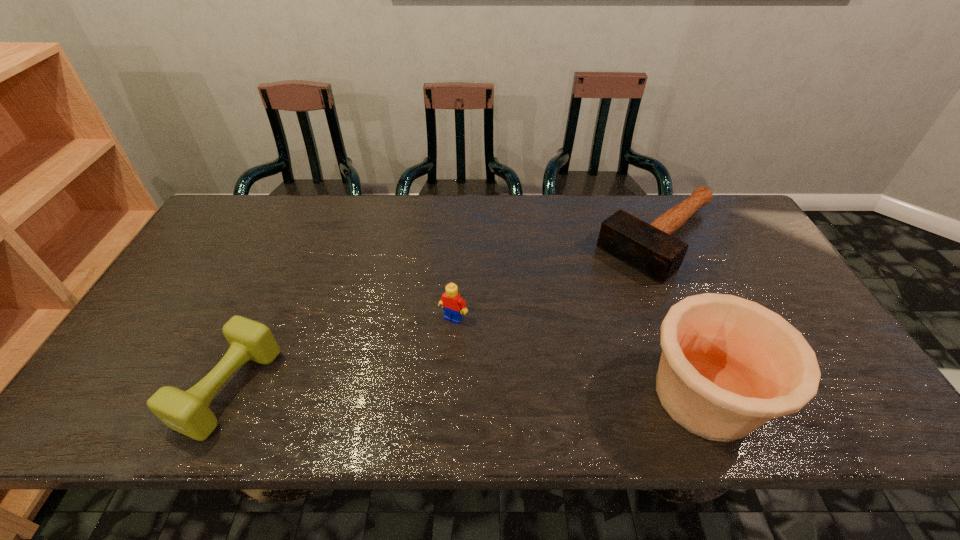
Where is `the leftmost object`? the leftmost object is located at coordinates (187, 412).

Identify the location of the tallest object. The image size is (960, 540). (729, 365).

Locate an element on the screen. Image resolution: width=960 pixels, height=540 pixels. the farthest object is located at coordinates (649, 248).

Where is `the third object from right to left`? This screenshot has width=960, height=540. the third object from right to left is located at coordinates (454, 306).

At what (x,y) coordinates should I click in order to perform the action: click on Lego. Please return your answer as a coordinate pair (x, y). The height and width of the screenshot is (540, 960). Looking at the image, I should click on (454, 306).

You are a GUI agent. You are given a task and a screenshot of the screen. Output one action in this format:
    pyautogui.click(x=<x>, y=<y>)
    Task: Click on the vacant point located 0.170m on the right of the leftmost object
    This screenshot has height=540, width=960.
    Given the screenshot: What is the action you would take?
    pyautogui.click(x=344, y=388)

This screenshot has width=960, height=540. I want to click on blank space located 0.160m on the back of the tallest object, so click(665, 296).

Identify the location of vacant space located 0.250m on the hammer head face of the farthest object. Image resolution: width=960 pixels, height=540 pixels. (566, 314).

Find the location of a particular element. The height and width of the screenshot is (540, 960). vacant region located on the hammer head face of the farthest object is located at coordinates (573, 308).

Locate an element on the screen. The width and height of the screenshot is (960, 540). free space located 0.120m on the hammer head face of the farthest object is located at coordinates (596, 290).